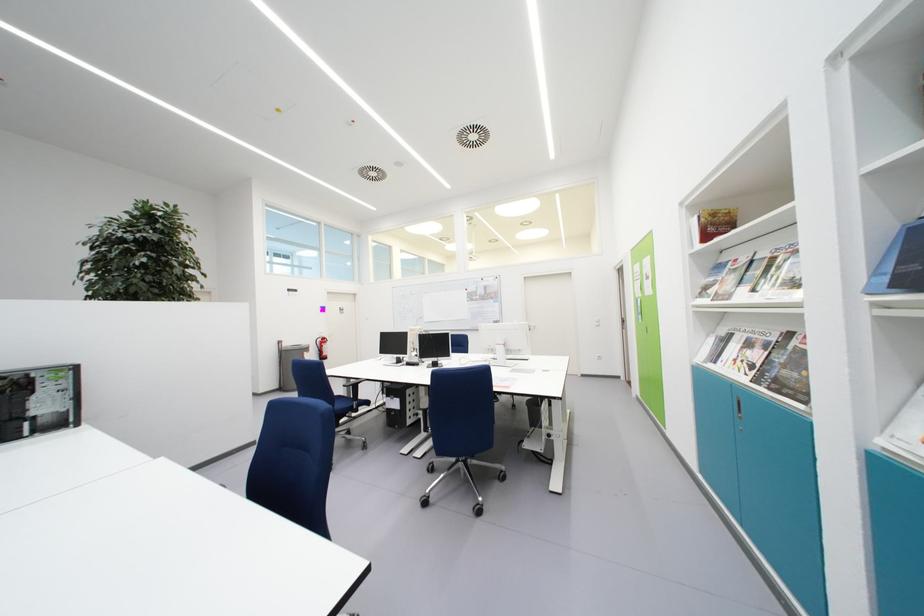
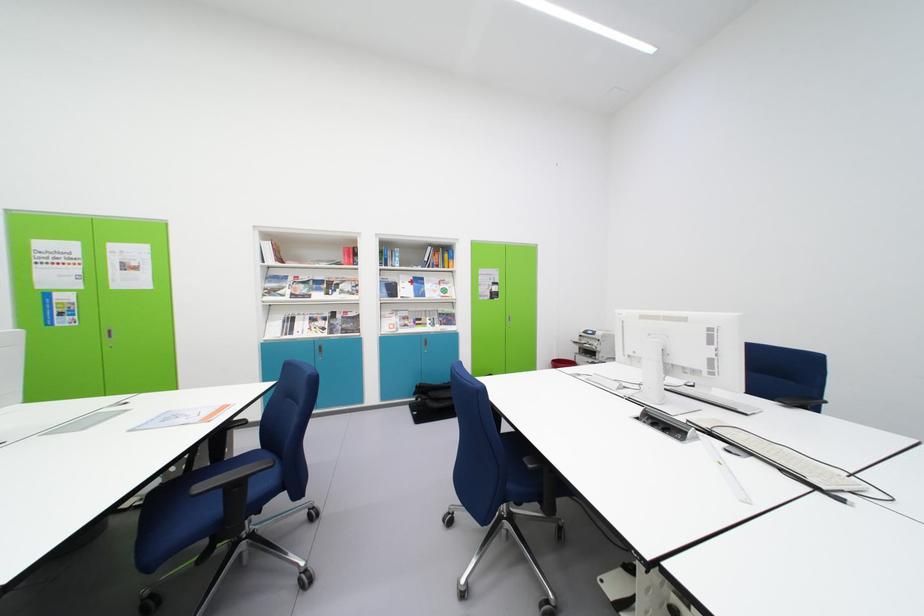
Where in the second image is the point corresponding to [801,349] from the first image?

(345, 320)